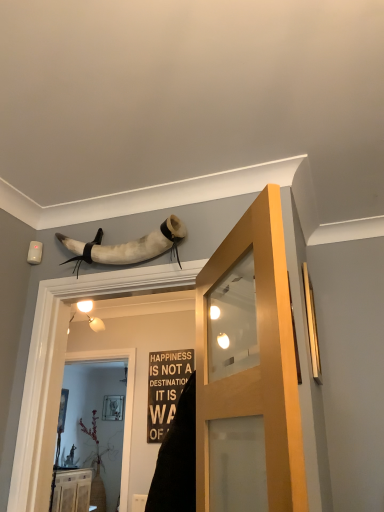
Question: Considering the relative positions of light brown wood cabinet at lower left and white leather horn at upper center in the image provided, is light brown wood cabinet at lower left to the left or to the right of white leather horn at upper center?

Choices:
 (A) left
 (B) right

Answer: (A)

Question: Which is correct: light brown wood cabinet at lower left is inside white leather horn at upper center, or outside of it?

Choices:
 (A) inside
 (B) outside

Answer: (B)

Question: Estimate the real-world distances between objects in this image. Which object is closer to the light brown wood cabinet at lower left?

Choices:
 (A) translucent glass screen door at center
 (B) gold metallic window at right
 (C) matte wood door at center
 (D) white leather horn at upper center

Answer: (A)

Question: Which of these objects is positioned farthest from the gold metallic window at right?

Choices:
 (A) light brown wood cabinet at lower left
 (B) white leather horn at upper center
 (C) matte wood door at center
 (D) translucent glass screen door at center

Answer: (A)